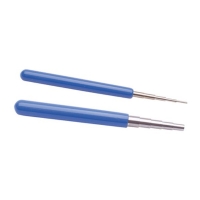
At what (x,y) coordinates should I click in order to perform the action: click on handles. Please return your answer as a coordinate pair (x, y). This screenshot has height=200, width=200. Looking at the image, I should click on tap(86, 119), tap(116, 93).